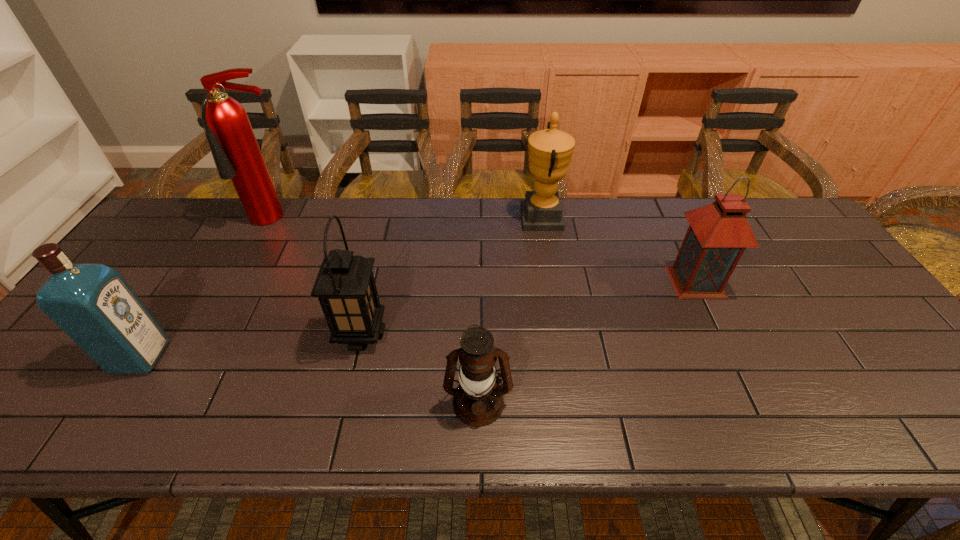
Image resolution: width=960 pixels, height=540 pixels. Identify the location of free space between the liquor and the nearest object. (310, 380).

Find the location of a particular element. This screenshot has width=960, height=540. vacant space that is in between the rightmost object and the fire extinguisher is located at coordinates (485, 251).

You are a GUI agent. You are given a task and a screenshot of the screen. Output one action in this format:
    pyautogui.click(x=<x>, y=<y>)
    Task: Click on the vacant area between the second object from left to right and the fifth object from left to right
    This screenshot has width=960, height=540.
    Given the screenshot: What is the action you would take?
    pyautogui.click(x=409, y=219)

Where is `object that stands as the fourth closest to the leftmost lantern`? The image size is (960, 540). object that stands as the fourth closest to the leftmost lantern is located at coordinates (550, 150).

Locate which object is the closest to the second nearest lantern. Please provide its 2D coordinates. Your answer should be formatted as a tuple, i.e. [(x, y)], where the tuple contains the x and y coordinates of a point satisfying the conditions above.

[(478, 401)]

Identify the location of lantern that is the closest to the second lantern from left to right. The height and width of the screenshot is (540, 960). (345, 286).

The height and width of the screenshot is (540, 960). I want to click on lantern object that ranks as the second closest to the second lantern from right to left, so click(718, 234).

I want to click on free spot that satisfies the following two spatial constraints: 1. on the back side of the fourth object from right to left; 2. on the right side of the rightmost object, so click(373, 281).

Identify the location of free location that satisfies the following two spatial constraints: 1. at the front of the second object from right to left with handles; 2. on the left side of the rightmost object. (553, 281).

Image resolution: width=960 pixels, height=540 pixels. What are the coordinates of `free space in the image that satisfies the following two spatial constraints: 1. at the front of the award with handles; 2. on the back side of the rightmost object` in the screenshot? It's located at (553, 281).